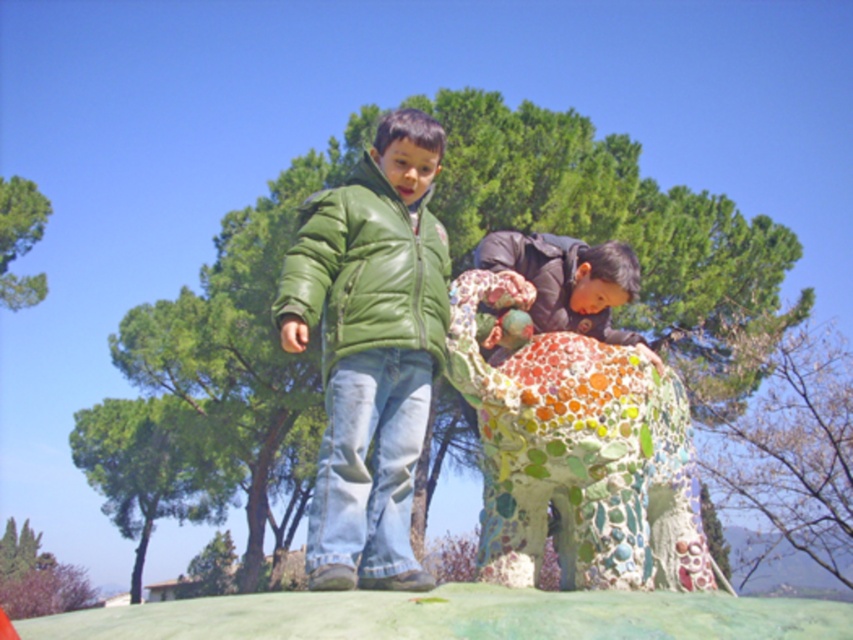
Who is more distant from viewer, (x=531, y=580) or (x=397, y=276)?

Point (x=531, y=580)

Is mosaic elephant at center taller than green leather jacket at center?

Indeed, mosaic elephant at center has a greater height compared to green leather jacket at center.

Find the location of `mosaic elephant at center`. mosaic elephant at center is located at coordinates (579, 456).

Is green matte jacket at center behind multicolored mosaic statue at center?

No, it is in front of multicolored mosaic statue at center.

Is point (334, 307) in front of point (608, 272)?

Yes.

Does point (292, 312) come closer to viewer compared to point (660, 365)?

Yes, it is in front of point (660, 365).

The width and height of the screenshot is (853, 640). Find the location of `green matte jacket at center`. green matte jacket at center is located at coordinates (370, 349).

Between point (509, 428) and point (564, 276), which one is positioned behind?

The point (564, 276) is behind.

What do you see at coordinates (579, 456) in the screenshot? I see `mosaic elephant at center` at bounding box center [579, 456].

Which is in front, point (505, 360) or point (589, 262)?

Point (505, 360) is more forward.

Identify the location of mosaic elephant at center. (579, 456).